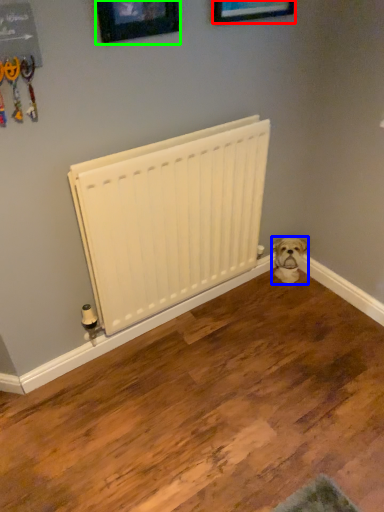
Question: Which is farther away from picture frame (highlighted by a red box)? dog (highlighted by a blue box) or picture frame (highlighted by a green box)?

Choices:
 (A) dog
 (B) picture frame

Answer: (A)